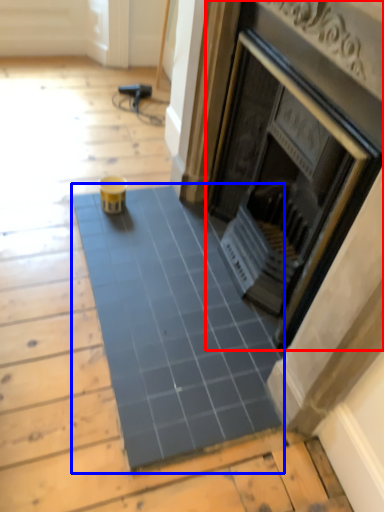
Question: Which point is closer to the camera, fireplace (highlighted by a red box) or ceramic tile (highlighted by a blue box)?

Choices:
 (A) fireplace
 (B) ceramic tile

Answer: (A)